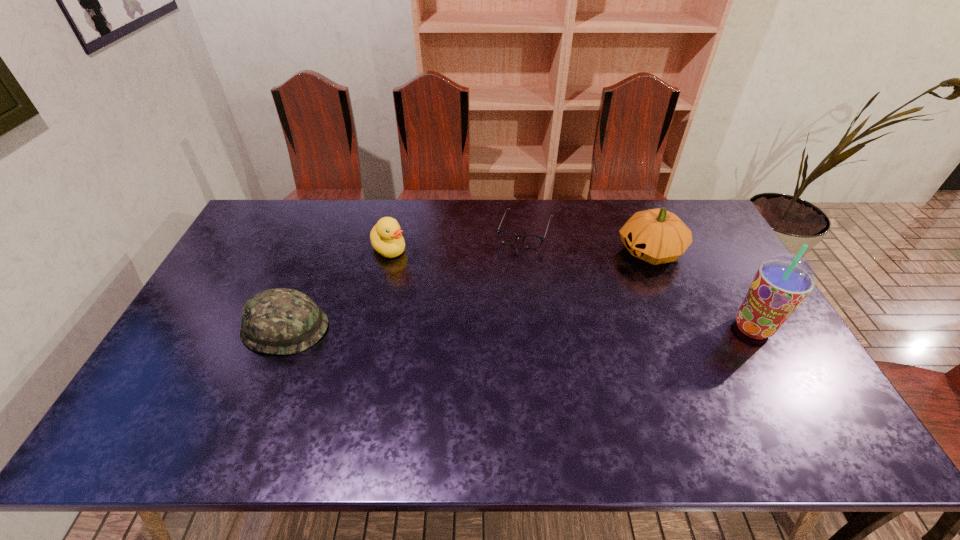
The height and width of the screenshot is (540, 960). I want to click on vacant position at the near left corner of the desktop, so click(187, 404).

Where is `vacant point located between the fourth object from left to right and the smoothie`? The image size is (960, 540). vacant point located between the fourth object from left to right and the smoothie is located at coordinates (702, 290).

Where is `empty space that is in between the headwear and the spectacles`? empty space that is in between the headwear and the spectacles is located at coordinates (405, 279).

Image resolution: width=960 pixels, height=540 pixels. What are the coordinates of `empty space between the headwear and the spectacles` in the screenshot? It's located at (405, 279).

Where is `vacant space in between the smoothie and the spectacles`? vacant space in between the smoothie and the spectacles is located at coordinates (638, 279).

At what (x,y) coordinates should I click in order to perform the action: click on empty space between the fourth object from right to left and the rightmost object. Please return your answer as a coordinate pair (x, y). Looking at the image, I should click on (571, 288).

Where is `vacant space that's between the fourth object from right to left and the fourth object from left to right`? The height and width of the screenshot is (540, 960). vacant space that's between the fourth object from right to left and the fourth object from left to right is located at coordinates (519, 250).

I want to click on free point between the gourd and the headwear, so click(x=468, y=290).

Where is `free space between the fourth object from right to left and the rightmost object`? The width and height of the screenshot is (960, 540). free space between the fourth object from right to left and the rightmost object is located at coordinates (571, 288).

What are the coordinates of `free area in between the duck and the smoothie` in the screenshot? It's located at (571, 288).